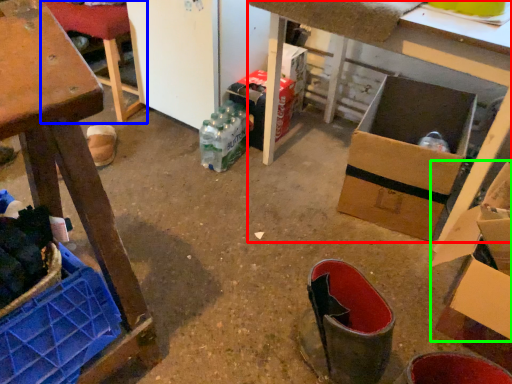
Question: Which object is positioned closest to table (highlighted by a red box)? Select from furniture (highlighted by a blue box) and cardboard box (highlighted by a green box).

Choices:
 (A) furniture
 (B) cardboard box

Answer: (B)